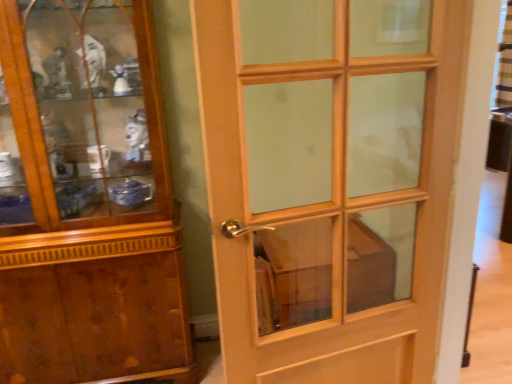
Question: From the image's perspective, relative to light wood/glass door at center, is wooden polished cupboard at left above or below?

Choices:
 (A) above
 (B) below

Answer: (A)

Question: In terms of size, does wooden polished cupboard at left appear bigger or smaller than light wood/glass door at center?

Choices:
 (A) small
 (B) big

Answer: (B)

Question: Considering their positions, is wooden polished cupboard at left located in front of or behind light wood/glass door at center?

Choices:
 (A) front
 (B) behind

Answer: (B)

Question: In terms of size, does light wood/glass door at center appear bigger or smaller than wooden polished cupboard at left?

Choices:
 (A) big
 (B) small

Answer: (B)

Question: From the image's perspective, is light wood/glass door at center above or below wooden polished cupboard at left?

Choices:
 (A) below
 (B) above

Answer: (A)

Question: Is light wood/glass door at center taller or shorter than wooden polished cupboard at left?

Choices:
 (A) tall
 (B) short

Answer: (B)

Question: Is light wood/glass door at center wider or thinner than wooden polished cupboard at left?

Choices:
 (A) thin
 (B) wide

Answer: (A)